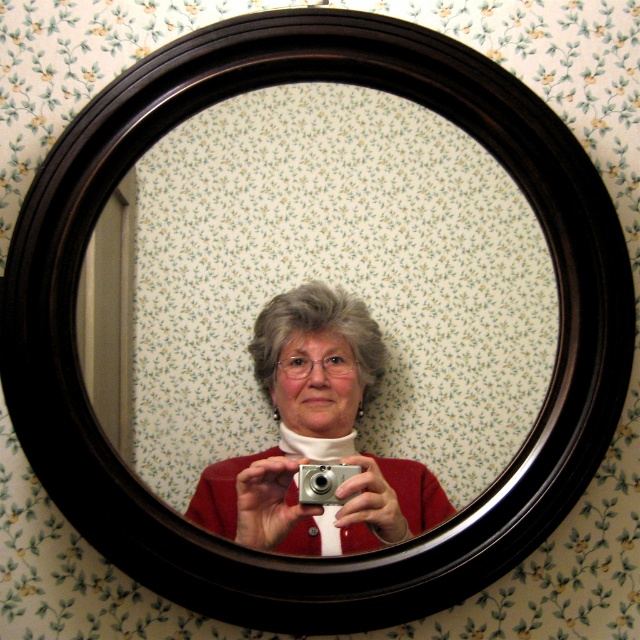
You are trying to hang a matte silver camera at center on the wall where the black wood mirror at center is currently hanging. Can you fit the camera in the same space without moving the mirror?

The black wood mirror at center might be wider than matte silver camera at center, so there is a possibility that the camera could fit in the same space if the mirror is removed, but since the mirror is currently occupying the spot, you would need to remove it first to assess the exact dimensions.

You are standing in front of the mirror and see two points marked on the wall. The first point is at coordinates point (124, 268) and the second is at point (310, 492). Which point is closer to you?

Point (310, 492) is closer to you because it is in front of point (124, 268).